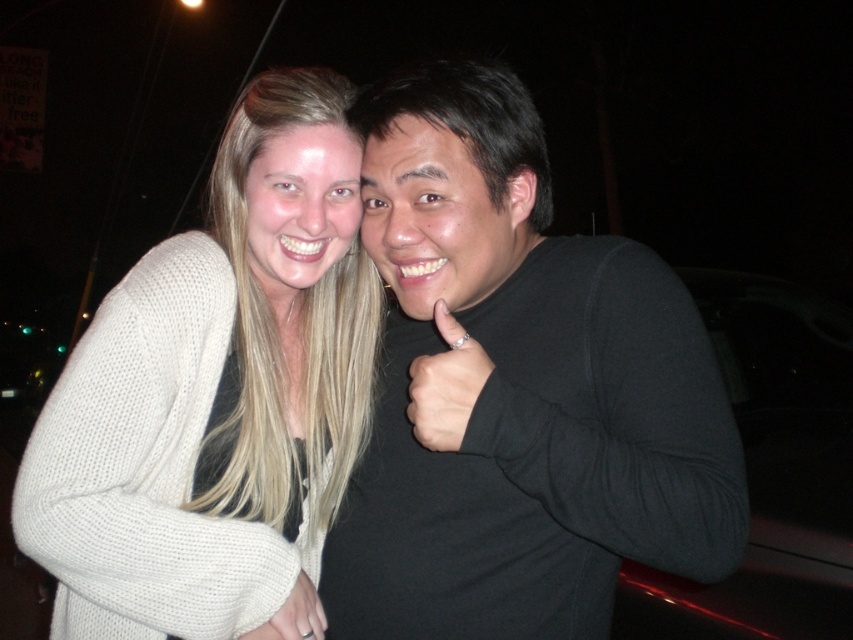
Question: Can you confirm if black matte turtleneck at center is positioned to the right of white knitted cardigan at upper left?

Choices:
 (A) no
 (B) yes

Answer: (B)

Question: Based on their relative distances, which object is nearer to the black matte turtleneck at center?

Choices:
 (A) black matte hand at center
 (B) white knitted cardigan at upper left

Answer: (A)

Question: Is black matte turtleneck at center to the right of black matte hand at center from the viewer's perspective?

Choices:
 (A) yes
 (B) no

Answer: (A)

Question: Which of the following is the closest to the observer?

Choices:
 (A) (432, 380)
 (B) (122, 490)

Answer: (A)

Question: Does black matte turtleneck at center appear on the left side of black matte hand at center?

Choices:
 (A) no
 (B) yes

Answer: (A)

Question: Which point is farther to the camera?

Choices:
 (A) black matte turtleneck at center
 (B) black matte hand at center
 (C) white knitted cardigan at upper left

Answer: (C)